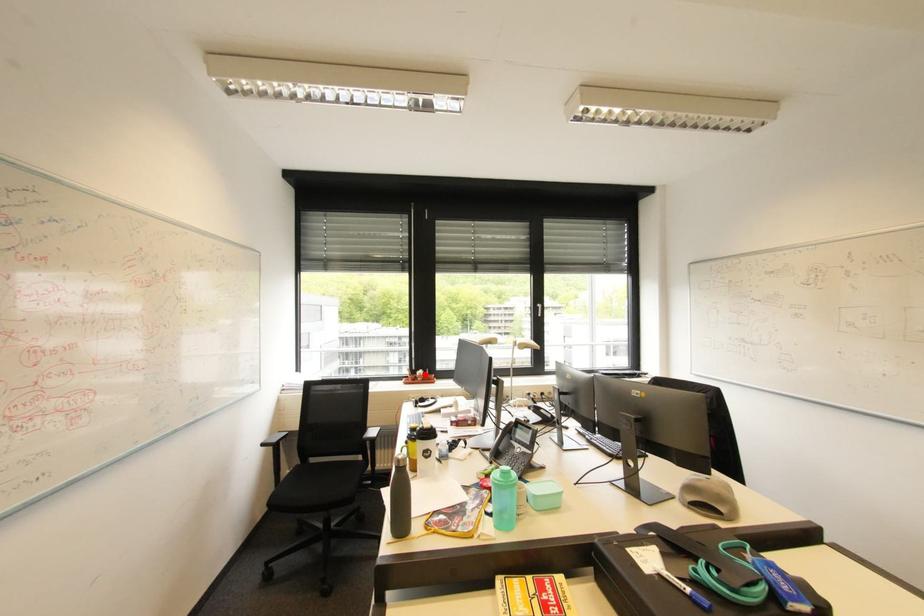
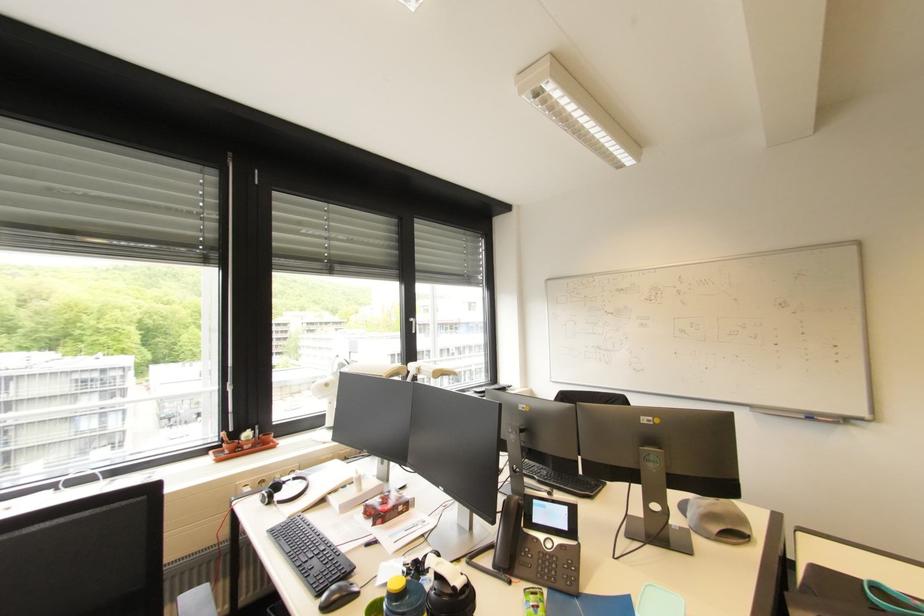
Find the pixel in the second image that matches the highlighted location in the first image.

(252, 438)